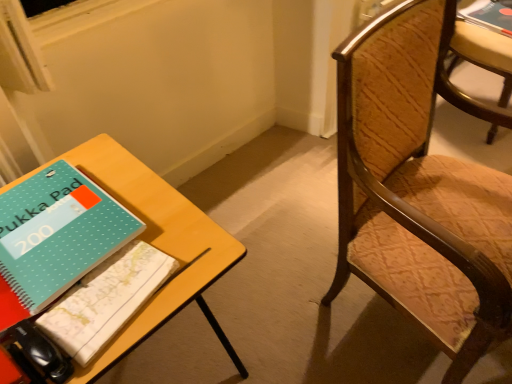
Identify the location of matte black book at upper right, which ranks as the 1th book in back-to-front order. This screenshot has width=512, height=384. (488, 16).

Measure the distance between teal dotted notebook at lower left, marked as the 2th book in a left-to-right arrangement, and camera.

teal dotted notebook at lower left, marked as the 2th book in a left-to-right arrangement, and camera are 25.71 inches apart.

The width and height of the screenshot is (512, 384). What do you see at coordinates (55, 237) in the screenshot? I see `teal matte notebook at left, the 1th book from the left` at bounding box center [55, 237].

Find the location of a particular element. This screenshot has width=512, height=384. wooden textured chair at right, the 2th chair viewed from the right is located at coordinates (419, 188).

Find the location of a particular element. matte black book at upper right, which ranks as the 1th book in back-to-front order is located at coordinates (488, 16).

Is wooden textured chair at right, the second chair from the back, thinner than wooden textured chair at right, which is counted as the second chair, starting from the left?

No, wooden textured chair at right, the second chair from the back, is not thinner than wooden textured chair at right, which is counted as the second chair, starting from the left.

Does wooden textured chair at right, acting as the 1th chair starting from the front, appear on the left side of wooden textured chair at right, which is counted as the second chair, starting from the left?

Correct, you'll find wooden textured chair at right, acting as the 1th chair starting from the front, to the left of wooden textured chair at right, which is counted as the second chair, starting from the left.

Would you consider wooden textured chair at right, acting as the 1th chair starting from the front, to be distant from wooden textured chair at right, which is counted as the second chair, starting from the left?

No, wooden textured chair at right, acting as the 1th chair starting from the front, is in close proximity to wooden textured chair at right, which is counted as the second chair, starting from the left.

Which point is more distant from viewer, (x=343, y=52) or (x=484, y=114)?

The point (x=484, y=114) is farther.

Considering the relative positions of yellow wood table at lower left and wooden textured chair at right, which is counted as the second chair, starting from the left, in the image provided, is yellow wood table at lower left to the right of wooden textured chair at right, which is counted as the second chair, starting from the left, from the viewer's perspective?

No, yellow wood table at lower left is not to the right of wooden textured chair at right, which is counted as the second chair, starting from the left.

Which of these two, yellow wood table at lower left or wooden textured chair at right, which is counted as the second chair, starting from the left, is wider?

yellow wood table at lower left.

Would you consider yellow wood table at lower left to be distant from wooden textured chair at right, which is counted as the second chair, starting from the left?

yellow wood table at lower left is positioned a significant distance from wooden textured chair at right, which is counted as the second chair, starting from the left.

From the image's perspective, relative to wooden textured chair at right, the first chair when ordered from back to front, is yellow wood table at lower left above or below?

Based on their image positions, yellow wood table at lower left is located beneath wooden textured chair at right, the first chair when ordered from back to front.

Considering the sizes of objects matte black book at upper right, which ranks as the 1th book in back-to-front order, and yellow wood table at lower left in the image provided, who is smaller, matte black book at upper right, which ranks as the 1th book in back-to-front order, or yellow wood table at lower left?

Smaller between the two is matte black book at upper right, which ranks as the 1th book in back-to-front order.

Is point (509, 33) closer or farther from the camera than point (129, 178)?

Point (509, 33) appears to be farther away from the viewer than point (129, 178).

Does matte black book at upper right, which ranks as the 1th book in back-to-front order, have a greater height compared to yellow wood table at lower left?

Incorrect, the height of matte black book at upper right, which ranks as the 1th book in back-to-front order, is not larger of that of yellow wood table at lower left.

Measure the distance from matte black book at upper right, acting as the third book starting from the bottom, to yellow wood table at lower left.

A distance of 1.73 meters exists between matte black book at upper right, acting as the third book starting from the bottom, and yellow wood table at lower left.

Looking at this image, from a real-world perspective, which is physically above, yellow wood table at lower left or wooden textured chair at right, the 2th chair viewed from the right?

wooden textured chair at right, the 2th chair viewed from the right, from a real-world perspective.

How different are the orientations of yellow wood table at lower left and wooden textured chair at right, the second chair from the back, in degrees?

The facing directions of yellow wood table at lower left and wooden textured chair at right, the second chair from the back, are 4.01 degrees apart.

Considering the relative sizes of yellow wood table at lower left and wooden textured chair at right, acting as the 1th chair starting from the front, in the image provided, is yellow wood table at lower left smaller than wooden textured chair at right, acting as the 1th chair starting from the front,?

Yes.

Could you tell me if yellow wood table at lower left is turned towards wooden textured chair at right, the 2th chair viewed from the right?

No, yellow wood table at lower left is not oriented towards wooden textured chair at right, the 2th chair viewed from the right.

How distant is wooden textured chair at right, the 2th chair viewed from the right, from yellow wood table at lower left?

They are 21.71 inches apart.

Which is nearer, (x=388, y=175) or (x=178, y=192)?

Point (x=388, y=175)

Does wooden textured chair at right, the 2th chair viewed from the right, appear on the left side of yellow wood table at lower left?

No, wooden textured chair at right, the 2th chair viewed from the right, is not to the left of yellow wood table at lower left.

From the image's perspective, is wooden textured chair at right, the second chair from the back, over yellow wood table at lower left?

Indeed, from the image's perspective, wooden textured chair at right, the second chair from the back, is shown above yellow wood table at lower left.

Based on the photo, can you confirm if matte black book at upper right, arranged as the first book when viewed from the top, is thinner than wooden textured chair at right, the first chair in the right-to-left sequence?

Yes, matte black book at upper right, arranged as the first book when viewed from the top, is thinner than wooden textured chair at right, the first chair in the right-to-left sequence.

Is matte black book at upper right, acting as the third book starting from the bottom, positioned before wooden textured chair at right, which is counted as the second chair, starting from the left?

That is False.

In terms of size, does matte black book at upper right, marked as the third book in a left-to-right arrangement, appear bigger or smaller than wooden textured chair at right, the first chair in the right-to-left sequence?

matte black book at upper right, marked as the third book in a left-to-right arrangement, is smaller than wooden textured chair at right, the first chair in the right-to-left sequence.

Is teal matte notebook at left, the 2th book viewed from the top, not within yellow wood table at lower left?

No, teal matte notebook at left, the 2th book viewed from the top, is not outside of yellow wood table at lower left.

You are a GUI agent. You are given a task and a screenshot of the screen. Output one action in this format:
    pyautogui.click(x=<x>, y=<y>)
    Task: Click on the table lying on the right of teal matte notebook at left, the 2th book when ordered from bottom to top
    The width and height of the screenshot is (512, 384).
    Given the screenshot: What is the action you would take?
    pyautogui.click(x=156, y=243)

Is teal matte notebook at left, the 1th book from the left, taller or shorter than yellow wood table at lower left?

In the image, teal matte notebook at left, the 1th book from the left, appears to be shorter than yellow wood table at lower left.

Would you say teal matte notebook at left, positioned as the 2th book in back-to-front order, is to the left or to the right of yellow wood table at lower left in the picture?

Based on their positions, teal matte notebook at left, positioned as the 2th book in back-to-front order, is located to the left of yellow wood table at lower left.

This screenshot has width=512, height=384. Find the location of `chair above the wooden textured chair at right, the 2th chair viewed from the right (from the image's perspective)`. chair above the wooden textured chair at right, the 2th chair viewed from the right (from the image's perspective) is located at coordinates (476, 65).

Image resolution: width=512 pixels, height=384 pixels. Identify the location of chair that is the 2nd one when counting rightward from the yellow wood table at lower left. (476, 65).

From the image, which object appears to be farther from matte black book at upper right, arranged as the first book when viewed from the top, wooden textured chair at right, the first chair when ordered from back to front, or wooden textured chair at right, the 2th chair viewed from the right?

Based on the image, wooden textured chair at right, the 2th chair viewed from the right, appears to be further to matte black book at upper right, arranged as the first book when viewed from the top.

In the scene shown: Estimate the real-world distances between objects in this image. Which object is further from wooden textured chair at right, the first chair when ordered from back to front, wooden textured chair at right, acting as the 1th chair starting from the front, or teal dotted notebook at lower left, which is counted as the 3th book, starting from the top?

teal dotted notebook at lower left, which is counted as the 3th book, starting from the top, lies further to wooden textured chair at right, the first chair when ordered from back to front, than the other object.

Estimate the real-world distances between objects in this image. Which object is further from matte black book at upper right, acting as the third book starting from the bottom, yellow wood table at lower left or wooden textured chair at right, acting as the 2th chair starting from the front?

yellow wood table at lower left is positioned further to the anchor matte black book at upper right, acting as the third book starting from the bottom.

When comparing their distances from wooden textured chair at right, the first chair when ordered from back to front, does wooden textured chair at right, the second chair from the back, or yellow wood table at lower left seem further?

The object further to wooden textured chair at right, the first chair when ordered from back to front, is yellow wood table at lower left.

From the image, which object appears to be farther from yellow wood table at lower left, wooden textured chair at right, acting as the 1th chair starting from the front, or teal matte notebook at left, the 1th book from the left?

wooden textured chair at right, acting as the 1th chair starting from the front, is positioned further to the anchor yellow wood table at lower left.

Which object lies further to the anchor point teal dotted notebook at lower left, which is counted as the 1th book, starting from the front, wooden textured chair at right, the first chair in the right-to-left sequence, or wooden textured chair at right, the 2th chair viewed from the right?

wooden textured chair at right, the first chair in the right-to-left sequence.

From the image, which object appears to be farther from yellow wood table at lower left, wooden textured chair at right, which ranks as the 1th chair in left-to-right order, or matte black book at upper right, marked as the third book in a left-to-right arrangement?

matte black book at upper right, marked as the third book in a left-to-right arrangement, is further to yellow wood table at lower left.

From the image, which object appears to be farther from wooden textured chair at right, the 2th chair viewed from the right, yellow wood table at lower left or teal dotted notebook at lower left, positioned as the 3th book in back-to-front order?

Based on the image, teal dotted notebook at lower left, positioned as the 3th book in back-to-front order, appears to be further to wooden textured chair at right, the 2th chair viewed from the right.

You are a GUI agent. You are given a task and a screenshot of the screen. Output one action in this format:
    pyautogui.click(x=<x>, y=<y>)
    Task: Click on the table situated between teal matte notebook at left, the 2th book when ordered from bottom to top, and matte black book at upper right, the 1th book from the right, from left to right
    The height and width of the screenshot is (384, 512).
    Given the screenshot: What is the action you would take?
    pyautogui.click(x=156, y=243)

Where is `book between teal matte notebook at left, the 2th book viewed from the top, and yellow wood table at lower left vertically`? Image resolution: width=512 pixels, height=384 pixels. book between teal matte notebook at left, the 2th book viewed from the top, and yellow wood table at lower left vertically is located at coordinates (106, 300).

The image size is (512, 384). I want to click on chair located between teal matte notebook at left, the 2th book viewed from the top, and wooden textured chair at right, the first chair in the right-to-left sequence, in the left-right direction, so click(x=419, y=188).

You are a GUI agent. You are given a task and a screenshot of the screen. Output one action in this format:
    pyautogui.click(x=<x>, y=<y>)
    Task: Click on the book between yellow wood table at lower left and wooden textured chair at right, the 2th chair viewed from the right
    This screenshot has height=384, width=512.
    Given the screenshot: What is the action you would take?
    pyautogui.click(x=106, y=300)